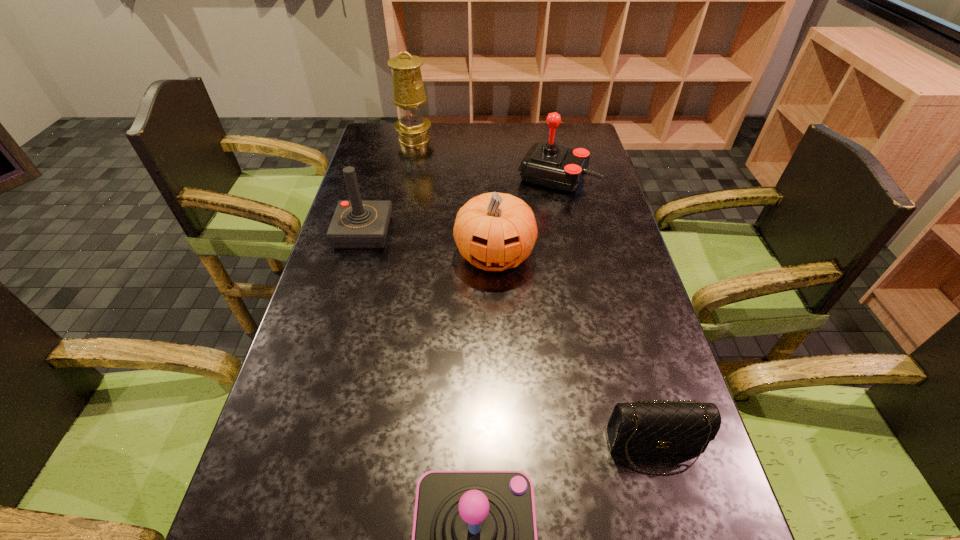
The height and width of the screenshot is (540, 960). What are the coordinates of `object that stands as the closest to the rightmost joystick` in the screenshot? It's located at (494, 231).

Identify which object is located as the fifth nearest to the shortest object. Please provide its 2D coordinates. Your answer should be formatted as a tuple, i.e. [(x, y)], where the tuple contains the x and y coordinates of a point satisfying the conditions above.

[(408, 90)]

Point out which joystick is positioned as the second nearest to the second farthest object. Please provide its 2D coordinates. Your answer should be formatted as a tuple, i.e. [(x, y)], where the tuple contains the x and y coordinates of a point satisfying the conditions above.

[(474, 539)]

Where is `the closest joystick to the shortest object`? This screenshot has width=960, height=540. the closest joystick to the shortest object is located at coordinates (474, 539).